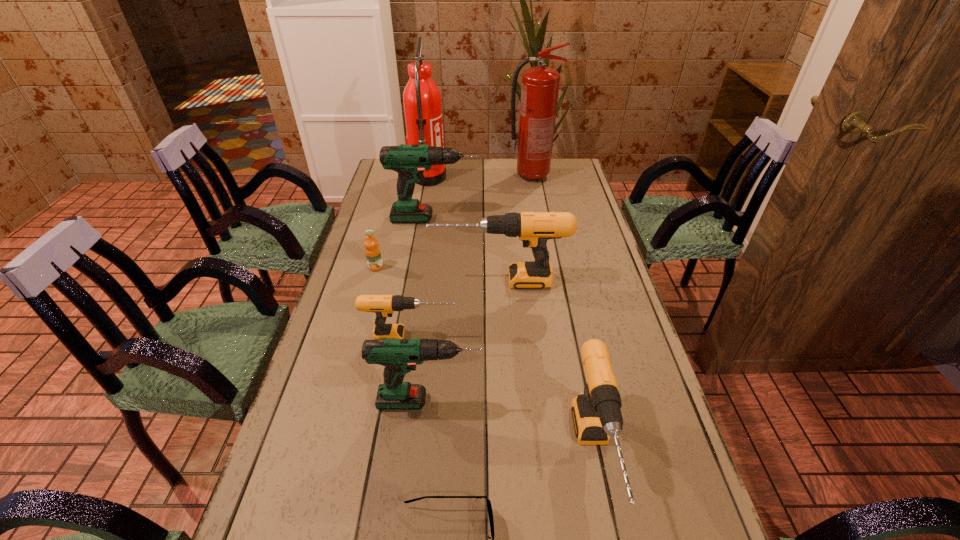
At what (x,y) coordinates should I click in order to perform the action: click on orange juice at the left edge. Please return your answer as a coordinate pair (x, y). The width and height of the screenshot is (960, 540). Looking at the image, I should click on (372, 250).

You are a GUI agent. You are given a task and a screenshot of the screen. Output one action in this format:
    pyautogui.click(x=<x>, y=<y>)
    Task: Click on the fire extinguisher that is positioned at the right edge
    
    Given the screenshot: What is the action you would take?
    pyautogui.click(x=540, y=85)

Where is `drill present at the right edge`? This screenshot has height=540, width=960. drill present at the right edge is located at coordinates (534, 229).

Locate an element on the screen. Image resolution: width=960 pixels, height=540 pixels. object at the far left corner is located at coordinates (422, 102).

Locate an element on the screen. Image resolution: width=960 pixels, height=540 pixels. object at the far right corner is located at coordinates (540, 85).

At what (x,y) coordinates should I click in order to perform the action: click on free space at the far edge of the desktop. Please return your answer as a coordinate pair (x, y). The height and width of the screenshot is (540, 960). Looking at the image, I should click on coord(468,185).

Locate an element on the screen. This screenshot has width=960, height=540. vacant position at the left edge of the desktop is located at coordinates (360, 397).

At what (x,y) coordinates should I click in order to perform the action: click on vacant area at the right edge. Please return your answer as a coordinate pair (x, y). Image resolution: width=960 pixels, height=540 pixels. Looking at the image, I should click on (596, 264).

This screenshot has width=960, height=540. I want to click on empty location between the nearer green drill and the bigger green drill, so click(433, 310).

The image size is (960, 540). What are the coordinates of `free spot between the biggest black drill and the nearer green drill` in the screenshot? It's located at (465, 341).